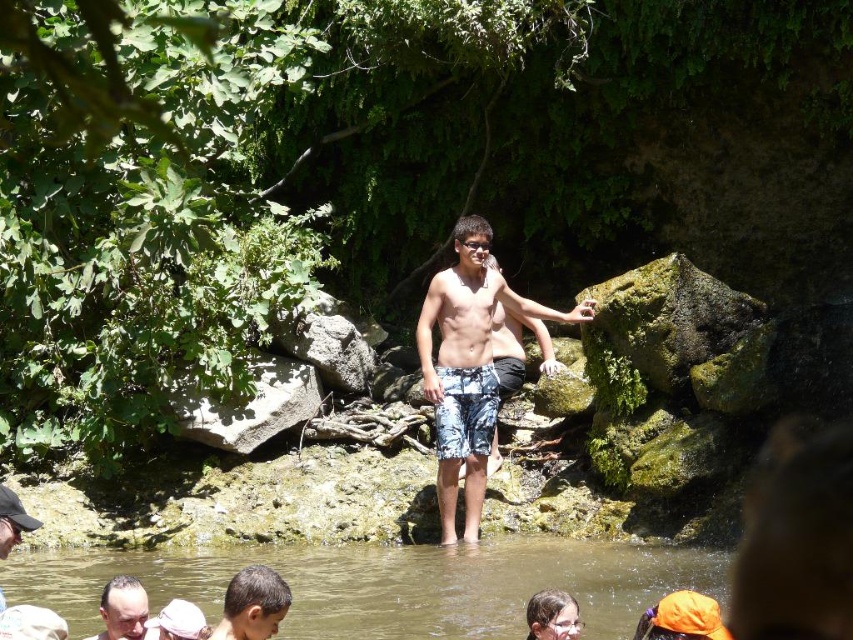
Question: Can you confirm if brown smooth water at lower center is positioned to the left of dark brown hair at lower left?

Choices:
 (A) no
 (B) yes

Answer: (A)

Question: Can you confirm if brown smooth water at lower center is bigger than camouflage shorts at center?

Choices:
 (A) no
 (B) yes

Answer: (B)

Question: Among these objects, which one is farthest from the camera?

Choices:
 (A) smooth brown hair at lower center
 (B) camouflage shorts at center

Answer: (B)

Question: Does smooth brown hair at lower center have a larger size compared to dark brown hair at lower left?

Choices:
 (A) no
 (B) yes

Answer: (B)

Question: Based on their relative distances, which object is farther from the smooth brown hair at lower center?

Choices:
 (A) camouflage shorts at center
 (B) brown smooth water at lower center

Answer: (A)

Question: Which object appears farthest from the camera in this image?

Choices:
 (A) brown smooth water at lower center
 (B) camouflage shorts at center

Answer: (B)